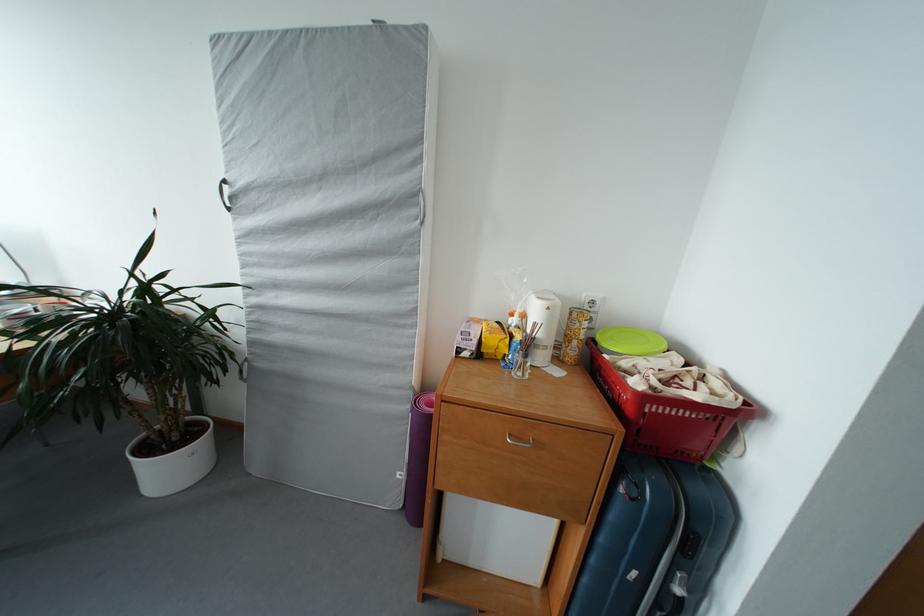
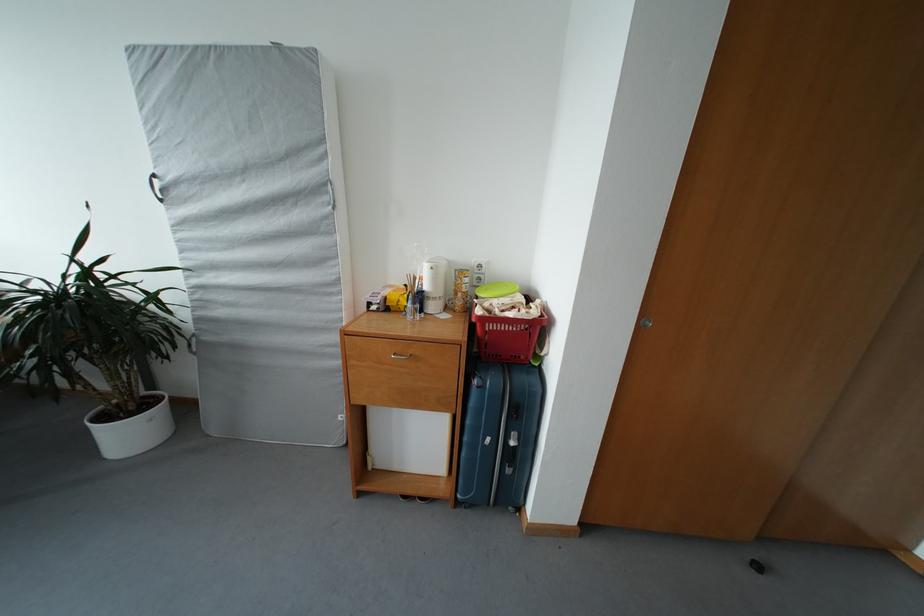
Locate, in the second image, the point that corresponds to point 205,414 in the first image.

(159, 391)